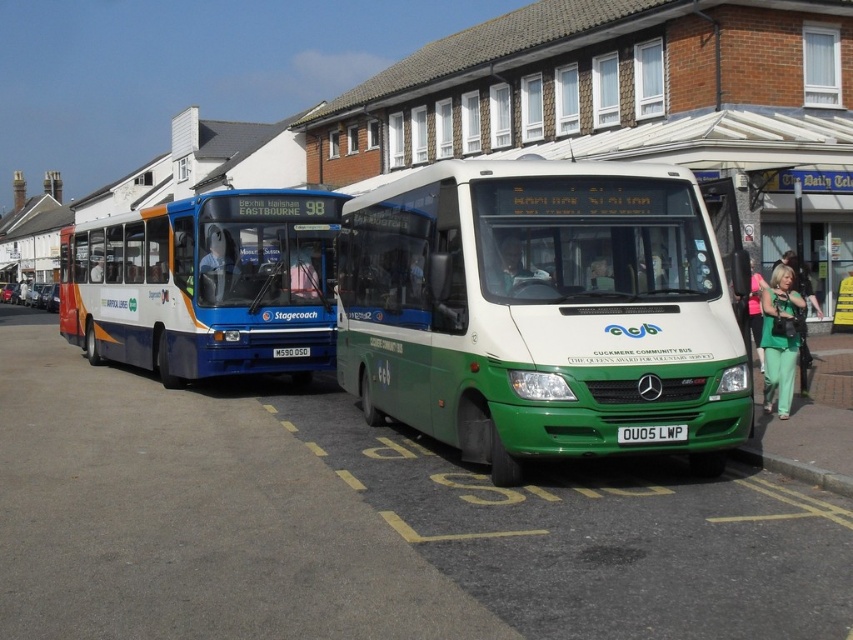
Can you confirm if green matte bus at center is taller than black plastic license plate at center?

Yes, green matte bus at center is taller than black plastic license plate at center.

Can you confirm if green matte bus at center is positioned below black plastic license plate at center?

No.

This screenshot has height=640, width=853. I want to click on green matte bus at center, so click(x=540, y=310).

You are a GUI agent. You are given a task and a screenshot of the screen. Output one action in this format:
    pyautogui.click(x=<x>, y=<y>)
    Task: Click on the green matte bus at center
    The width and height of the screenshot is (853, 640).
    Given the screenshot: What is the action you would take?
    pyautogui.click(x=540, y=310)

Is blue metallic bus at center below black plastic license plate at center?

No, blue metallic bus at center is not below black plastic license plate at center.

Which of these two, blue metallic bus at center or black plastic license plate at center, stands shorter?

With less height is black plastic license plate at center.

Which is behind, point (91, 324) or point (282, 352)?

The point (91, 324) is behind.

You are a GUI agent. You are given a task and a screenshot of the screen. Output one action in this format:
    pyautogui.click(x=<x>, y=<y>)
    Task: Click on the blue metallic bus at center
    The width and height of the screenshot is (853, 640).
    Given the screenshot: What is the action you would take?
    pyautogui.click(x=206, y=284)

Can you confirm if green matte bus at center is thinner than white plastic license plate at center?

In fact, green matte bus at center might be wider than white plastic license plate at center.

Can you confirm if green matte bus at center is positioned below white plastic license plate at center?

Actually, green matte bus at center is above white plastic license plate at center.

Locate an element on the screen. green matte bus at center is located at coordinates (540, 310).